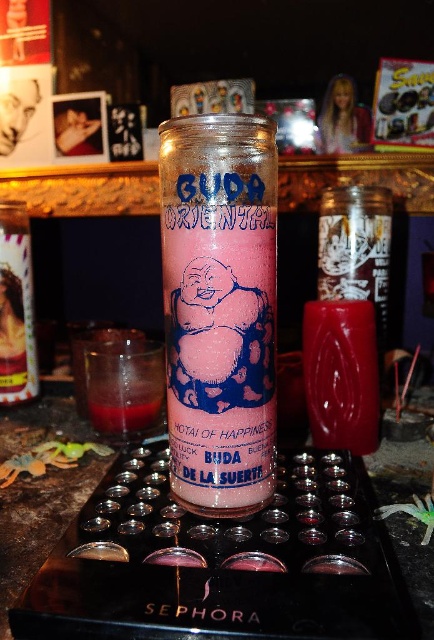
Question: Is pink glitter candle at center positioned at the back of translucent glass tray at center?

Choices:
 (A) no
 (B) yes

Answer: (B)

Question: Can you confirm if pink glitter candle at center is wider than translucent glass tray at center?

Choices:
 (A) no
 (B) yes

Answer: (A)

Question: Is pink glitter candle at center to the left of translucent glass tray at center from the viewer's perspective?

Choices:
 (A) no
 (B) yes

Answer: (A)